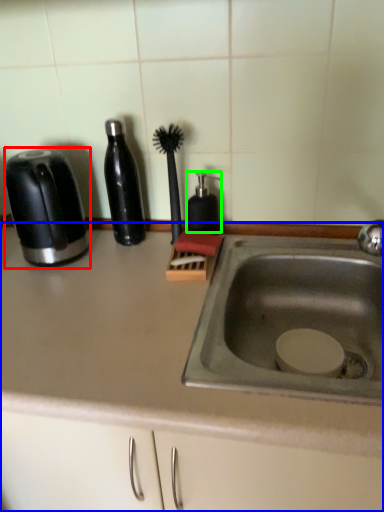
Question: Which is farther away from toaster (highlighted by a red box)? countertop (highlighted by a blue box) or soap dispenser (highlighted by a green box)?

Choices:
 (A) countertop
 (B) soap dispenser

Answer: (B)